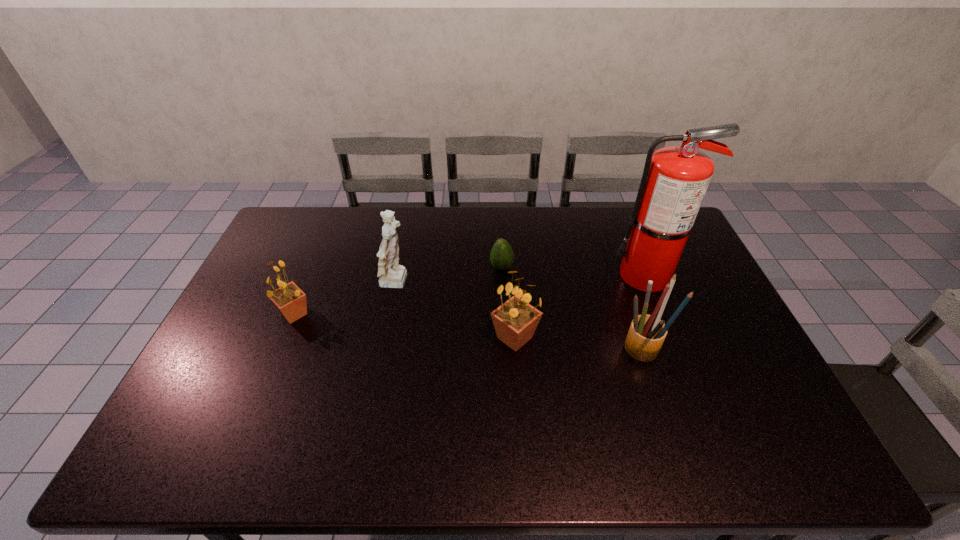
Identify which object is the fifth nearest to the tallest object. Please provide its 2D coordinates. Your answer should be formatted as a tuple, i.e. [(x, y)], where the tuple contains the x and y coordinates of a point satisfying the conditions above.

[(289, 299)]

Where is `free space in the image that satisfies the following two spatial constraints: 1. at the front of the taller sunflower with flowers visible; 2. on the left side of the pencil box`? This screenshot has height=540, width=960. free space in the image that satisfies the following two spatial constraints: 1. at the front of the taller sunflower with flowers visible; 2. on the left side of the pencil box is located at coordinates (516, 352).

Locate an element on the screen. This screenshot has height=540, width=960. vacant space that satisfies the following two spatial constraints: 1. on the front-facing side of the figurine; 2. on the back side of the pencil box is located at coordinates (383, 352).

Where is `vacant space that satisfies the following two spatial constraints: 1. on the front-facing side of the pencil box; 2. on the right side of the figurine`? The height and width of the screenshot is (540, 960). vacant space that satisfies the following two spatial constraints: 1. on the front-facing side of the pencil box; 2. on the right side of the figurine is located at coordinates (x=383, y=352).

This screenshot has width=960, height=540. In order to click on free space in the image that satisfies the following two spatial constraints: 1. on the front-facing side of the pencil box; 2. on the left side of the fifth object from right to left in this screenshot , I will do `click(383, 352)`.